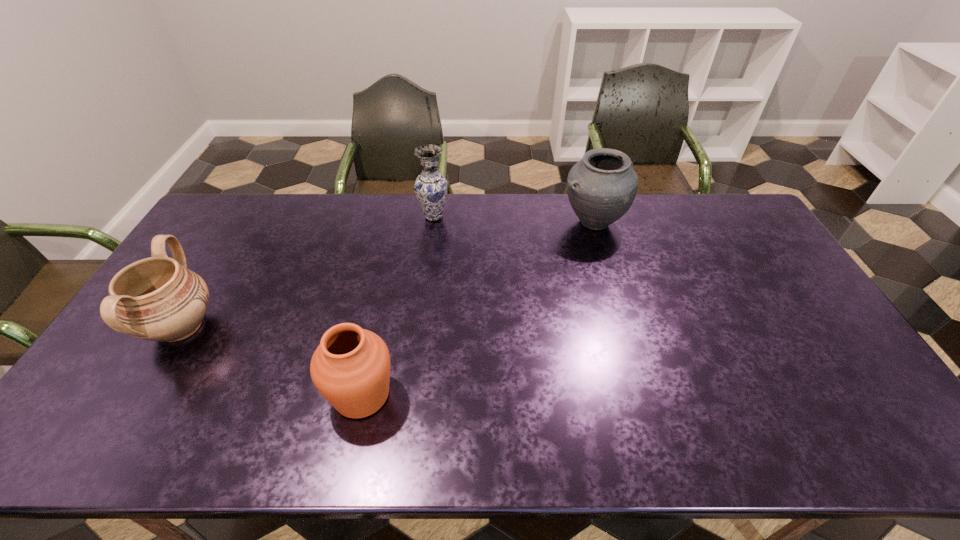
This screenshot has width=960, height=540. Find the location of `vase`. vase is located at coordinates (430, 187).

The width and height of the screenshot is (960, 540). What are the coordinates of `the rightmost object` in the screenshot? It's located at (601, 187).

This screenshot has height=540, width=960. I want to click on the farthest urn, so click(x=601, y=187).

Identify the location of the leftmost urn. (157, 299).

Image resolution: width=960 pixels, height=540 pixels. Find the location of `the second urn from left to right`. the second urn from left to right is located at coordinates (351, 367).

Locate an element on the screen. This screenshot has height=540, width=960. vacant space situated on the back of the vase is located at coordinates (437, 194).

The width and height of the screenshot is (960, 540). I want to click on free space located 0.340m on the left of the rightmost urn, so click(x=466, y=222).

This screenshot has height=540, width=960. What are the coordinates of `free space located 0.330m on the front-facing side of the leftmost object` in the screenshot? It's located at (336, 327).

Where is `free region located 0.050m on the left of the second urn from left to right`? The width and height of the screenshot is (960, 540). free region located 0.050m on the left of the second urn from left to right is located at coordinates (306, 395).

I want to click on vase that is at the far edge, so click(x=430, y=187).